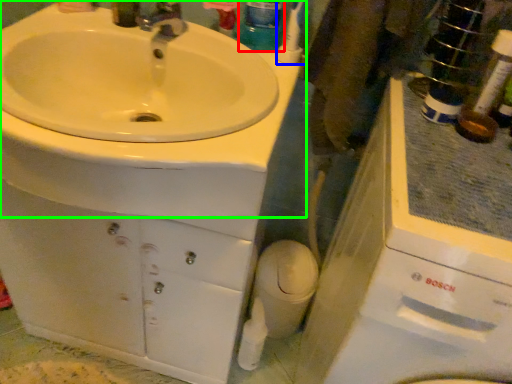
Question: Considering the real-world distances, which object is closest to mouthwash (highlighted by a red box)? toothbrush (highlighted by a blue box) or sink (highlighted by a green box).

Choices:
 (A) toothbrush
 (B) sink

Answer: (A)